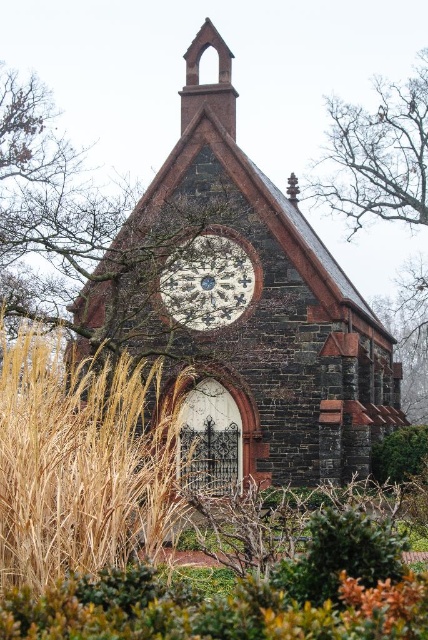
Is dark brown stone chapel at center thinner than green leafy bush at lower right?

No, dark brown stone chapel at center is not thinner than green leafy bush at lower right.

Between dark brown stone chapel at center and green leafy bush at lower right, which one appears on the right side from the viewer's perspective?

Positioned to the right is green leafy bush at lower right.

Is point (225, 420) less distant than point (422, 429)?

Yes, point (225, 420) is closer to viewer.

Identify the location of dark brown stone chapel at center. The image size is (428, 640). (244, 308).

Which is in front, point (214, 317) or point (385, 461)?

Point (385, 461) is more forward.

Is white stone clock at center above green leafy bush at lower right?

Indeed, white stone clock at center is positioned over green leafy bush at lower right.

Is point (247, 304) positioned after point (394, 481)?

Yes.

You are a GUI agent. You are given a task and a screenshot of the screen. Output one action in this format:
    pyautogui.click(x=<x>, y=<y>)
    Task: Click on the white stone clock at center
    
    Given the screenshot: What is the action you would take?
    pyautogui.click(x=208, y=282)

Can you confirm if bare branches at upper right is positioned below green leafy bush at lower right?

Actually, bare branches at upper right is above green leafy bush at lower right.

Can you confirm if bare branches at upper right is bigger than green leafy bush at lower right?

Indeed, bare branches at upper right has a larger size compared to green leafy bush at lower right.

Where is `bare branches at upper right`? The image size is (428, 640). bare branches at upper right is located at coordinates (377, 156).